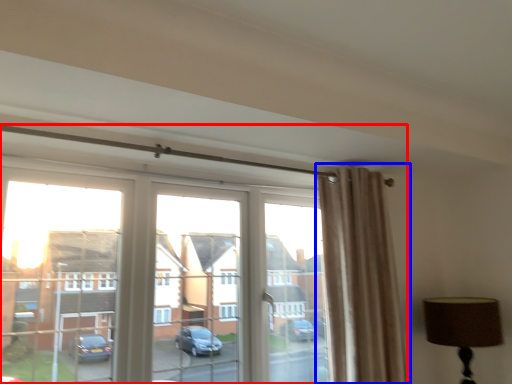
Question: Which object is further to the camera taking this photo, window (highlighted by a red box) or curtain (highlighted by a blue box)?

Choices:
 (A) window
 (B) curtain

Answer: (B)